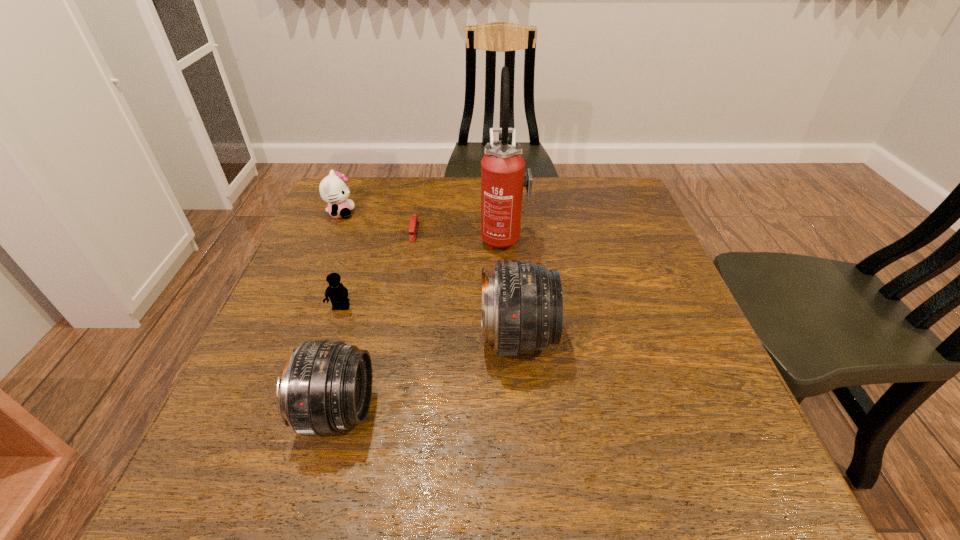
Observe the arrangement of all telephoto lenss in the image. To keep them evenly spaced, where would you place another telephoto lens on the right? Please locate a free space. Please provide its 2D coordinates. Your answer should be formatted as a tuple, i.e. [(x, y)], where the tuple contains the x and y coordinates of a point satisfying the conditions above.

[(652, 282)]